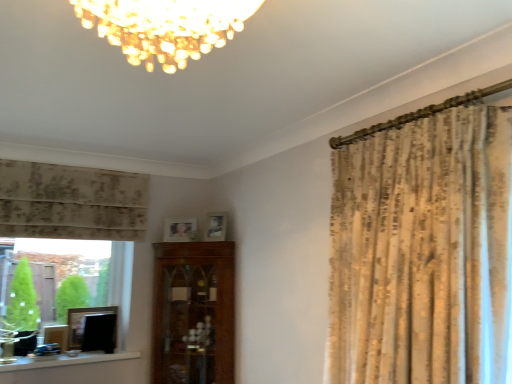
Question: Considering the relative sizes of matte wooden picture frame at center, which is the 3th picture frame in left-to-right order, and neutral floral fabric curtain at left in the image provided, is matte wooden picture frame at center, which is the 3th picture frame in left-to-right order, thinner than neutral floral fabric curtain at left?

Choices:
 (A) no
 (B) yes

Answer: (B)

Question: Is matte wooden picture frame at center, which is the 3th picture frame in left-to-right order, bigger than neutral floral fabric curtain at left?

Choices:
 (A) no
 (B) yes

Answer: (A)

Question: Would you say matte wooden picture frame at center, the second picture frame from the top, is outside neutral floral fabric curtain at left?

Choices:
 (A) no
 (B) yes

Answer: (B)

Question: From the image's perspective, is matte wooden picture frame at center, the second picture frame positioned from the right, on neutral floral fabric curtain at left?

Choices:
 (A) no
 (B) yes

Answer: (A)

Question: Is neutral floral fabric curtain at left inside matte wooden picture frame at center, positioned as the 3th picture frame in bottom-to-top order?

Choices:
 (A) no
 (B) yes

Answer: (A)

Question: Based on their sizes in the image, would you say wooden picture frame at lower left, the 1th picture frame when ordered from bottom to top, is bigger or smaller than matte wooden picture frame at center, positioned as the 3th picture frame in bottom-to-top order?

Choices:
 (A) big
 (B) small

Answer: (A)

Question: Choose the correct answer: Is wooden picture frame at lower left, the 1th picture frame when ordered from bottom to top, inside matte wooden picture frame at center, positioned as the 3th picture frame in bottom-to-top order, or outside it?

Choices:
 (A) outside
 (B) inside

Answer: (A)

Question: In the image, is wooden picture frame at lower left, positioned as the first picture frame in left-to-right order, on the left side or the right side of matte wooden picture frame at center, which is the 3th picture frame in left-to-right order?

Choices:
 (A) right
 (B) left

Answer: (B)

Question: In terms of height, does wooden picture frame at lower left, positioned as the first picture frame in left-to-right order, look taller or shorter compared to matte wooden picture frame at center, which is the 3th picture frame in left-to-right order?

Choices:
 (A) tall
 (B) short

Answer: (A)

Question: Based on their sizes in the image, would you say matte wooden picture frame at center, the second picture frame from the top, is bigger or smaller than white painted wood at lower left?

Choices:
 (A) big
 (B) small

Answer: (B)

Question: From a real-world perspective, is matte wooden picture frame at center, which is the 3th picture frame in left-to-right order, physically located above or below white painted wood at lower left?

Choices:
 (A) above
 (B) below

Answer: (A)

Question: Relative to white painted wood at lower left, is matte wooden picture frame at center, the second picture frame from the top, in front or behind?

Choices:
 (A) behind
 (B) front

Answer: (A)

Question: Which is correct: matte wooden picture frame at center, positioned as the 3th picture frame in bottom-to-top order, is inside white painted wood at lower left, or outside of it?

Choices:
 (A) outside
 (B) inside

Answer: (A)

Question: Is point (133, 357) closer or farther from the camera than point (56, 240)?

Choices:
 (A) farther
 (B) closer

Answer: (A)

Question: Relative to green glass at left, is white painted wood at lower left in front or behind?

Choices:
 (A) front
 (B) behind

Answer: (A)